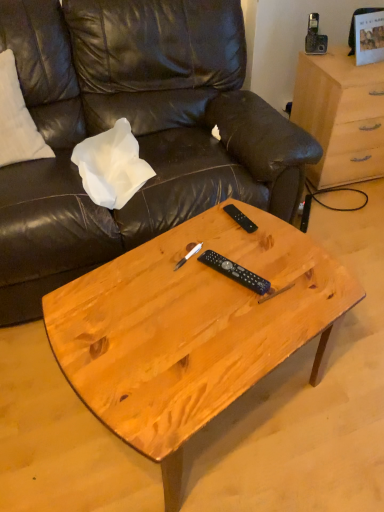
In order to click on vacant space that is to the left of black plastic remote at center, marked as the 1th remote in a top-to-bottom arrangement in this screenshot , I will do `click(196, 233)`.